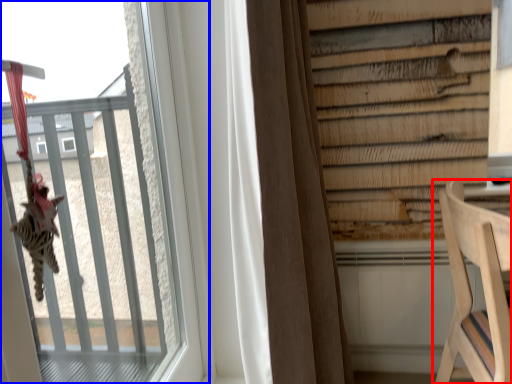
Question: Among these objects, which one is farthest to the camera, furniture (highlighted by a red box) or window (highlighted by a blue box)?

Choices:
 (A) furniture
 (B) window

Answer: (A)